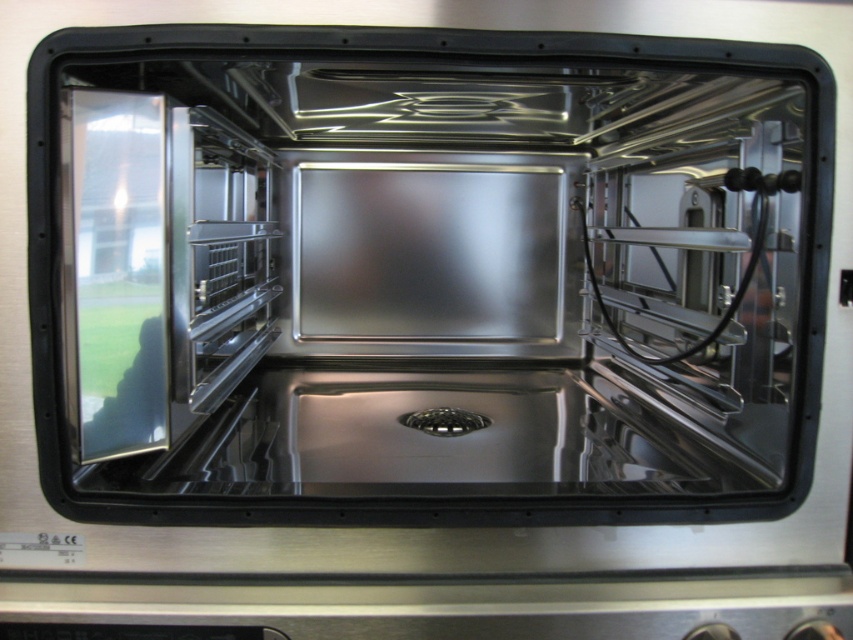
You are a chef trying to clean the oven. You need to reach the back wall of the stainless steel oven at center to scrub it. Can you do this without opening the transparent glass door at left?

The stainless steel oven at center is in front of the transparent glass door at left, so the transparent glass door is behind the oven. Therefore, you can open the oven door and reach the back wall of the stainless steel oven at center without needing to open the transparent glass door at left.

You are a chef who needs to slide a 12 inch wide baking tray into the oven. The oven has two racks on either side. Can you fit the baking tray between the stainless steel oven at center and the polished stainless steel exhaust hood at center?

The stainless steel oven at center and polished stainless steel exhaust hood at center are 10.00 inches apart from each other. Since the baking tray is 12 inches wide, it cannot fit between them as the space is narrower than the tray.

You are a chef preparing to cook a large roast in the oven. You need to place the roast on the rack inside the stainless steel oven at center. However, you notice the polished stainless steel exhaust hood at center above it. Will the roast fit under the exhaust hood without touching it?

The stainless steel oven at center is positioned under the polished stainless steel exhaust hood at center, so the roast placed on the rack inside the stainless steel oven at center will fit under the exhaust hood without touching it.